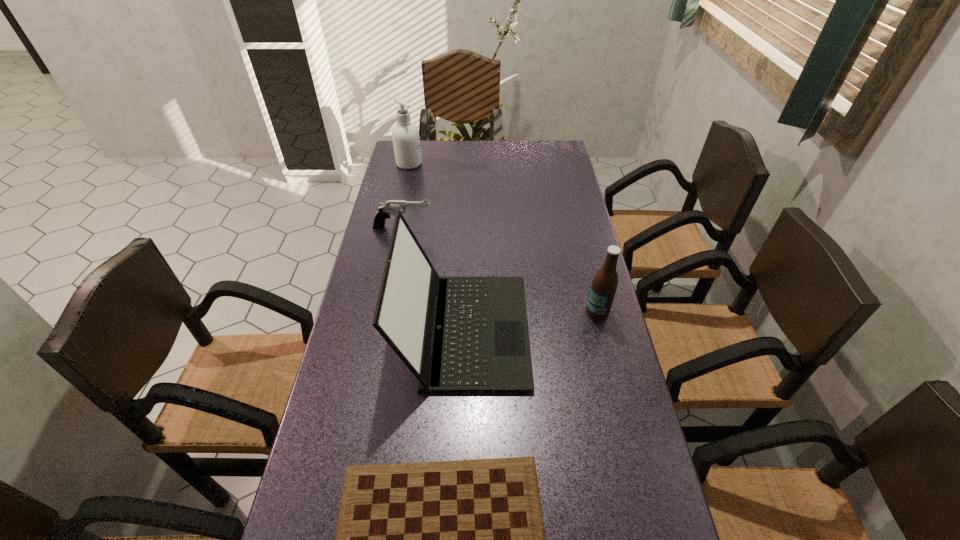
Identify the location of cleansing agent that is at the left edge. (406, 141).

You are a GUI agent. You are given a task and a screenshot of the screen. Output one action in this format:
    pyautogui.click(x=<x>, y=<y>)
    Task: Click on the laptop that is at the left edge
    
    Given the screenshot: What is the action you would take?
    pyautogui.click(x=456, y=334)

In order to click on gun located in the left edge section of the desktop in this screenshot , I will do `click(390, 207)`.

At what (x,y) coordinates should I click in order to perform the action: click on object positioned at the right edge. Please return your answer as a coordinate pair (x, y). The image size is (960, 540). Looking at the image, I should click on (604, 285).

You are a GUI agent. You are given a task and a screenshot of the screen. Output one action in this format:
    pyautogui.click(x=<x>, y=<y>)
    Task: Click on the object situated at the far left corner
    Image resolution: width=960 pixels, height=540 pixels.
    Given the screenshot: What is the action you would take?
    pyautogui.click(x=406, y=141)

Locate an element on the screen. Image resolution: width=960 pixels, height=540 pixels. vacant area at the far edge is located at coordinates (525, 140).

This screenshot has height=540, width=960. In the image, there is a desktop. Identify the location of vacant area at the left edge. (391, 226).

The image size is (960, 540). What are the coordinates of `vacant space at the right edge of the desktop` in the screenshot? It's located at (539, 216).

You are a GUI agent. You are given a task and a screenshot of the screen. Output one action in this format:
    pyautogui.click(x=<x>, y=<y>)
    Task: Click on the free space that is in between the cleansing agent and the laptop
    The image size is (960, 540).
    Given the screenshot: What is the action you would take?
    pyautogui.click(x=437, y=247)

In order to click on empty location between the laptop and the rightmost object in this screenshot , I will do `click(531, 321)`.